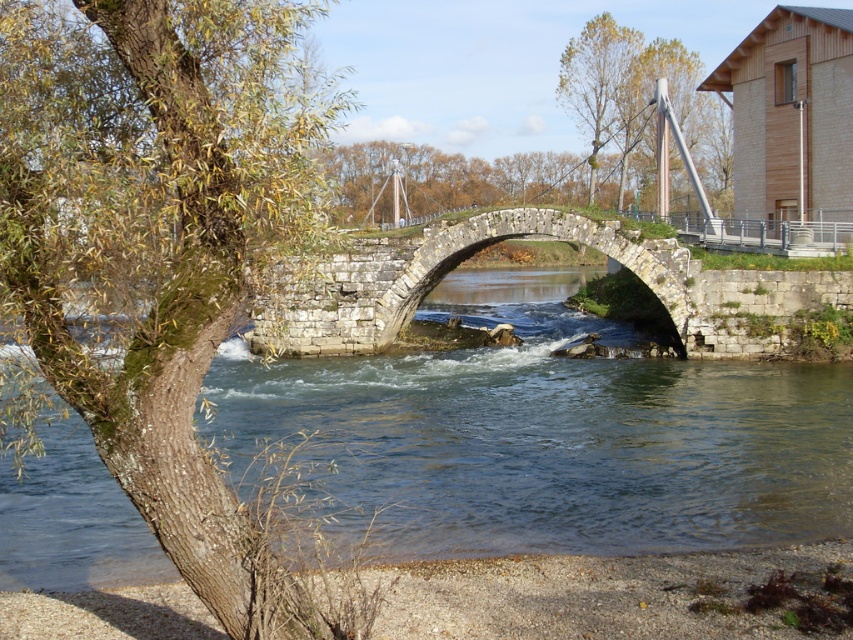
Based on the photo, you are standing at point (160, 244) in the riverside scene. What object is located exactly at your current position?

The green mossy bark tree at left is located exactly at point (160, 244).

You are standing on the stone bridge with a single arch and want to reach the green mossy bark tree at left. The distance between you and the tree is 4.49 meters. If your walking speed is 1.2 meters per second, how many seconds will it take you to reach the tree?

It will take approximately 3.74 seconds to reach the green mossy bark tree at left since the distance is 4.49 meters and the speed is 1.2 meters per second. Time equals distance divided by speed, so 4.49 divided by 1.2 equals approximately 3.74 seconds.

You are standing at the center of the stone bridge and want to locate the green mossy bark tree at left. Which direction should you face to see it?

The green mossy bark tree at left is located at point (x=160, y=244), which is to the left side of the frame. Therefore, you should face the left direction to see it.